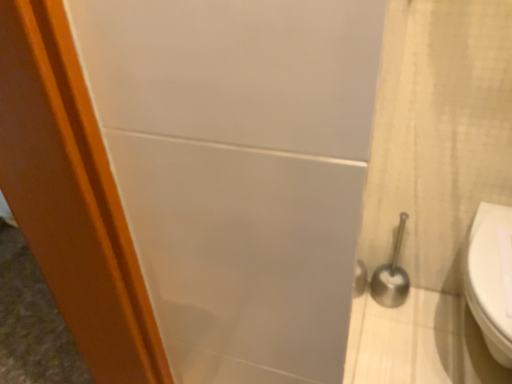
Question: Is point click(472, 312) positioned closer to the camera than point click(390, 271)?

Choices:
 (A) closer
 (B) farther

Answer: (A)

Question: Is white glossy toilet at right wider or thinner than satin silver toilet brush at right?

Choices:
 (A) wide
 (B) thin

Answer: (A)

Question: From a real-world perspective, is white glossy toilet at right physically located above or below satin silver toilet brush at right?

Choices:
 (A) above
 (B) below

Answer: (A)

Question: From the image's perspective, relative to white glossy toilet at right, is satin silver toilet brush at right above or below?

Choices:
 (A) above
 (B) below

Answer: (A)

Question: Is satin silver toilet brush at right wider or thinner than white glossy toilet at right?

Choices:
 (A) thin
 (B) wide

Answer: (A)

Question: Is satin silver toilet brush at right taller or shorter than white glossy toilet at right?

Choices:
 (A) tall
 (B) short

Answer: (A)

Question: Considering their positions, is satin silver toilet brush at right located in front of or behind white glossy toilet at right?

Choices:
 (A) behind
 (B) front

Answer: (A)